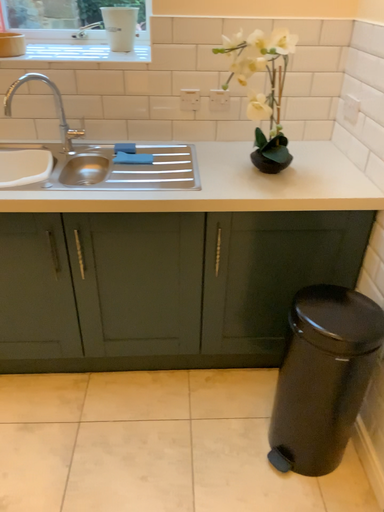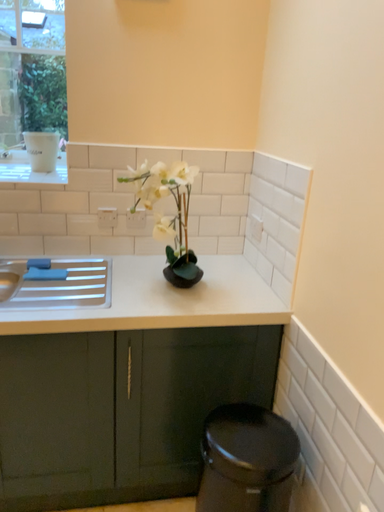
Question: Which way did the camera rotate in the video?

Choices:
 (A) rotated right
 (B) rotated left

Answer: (A)